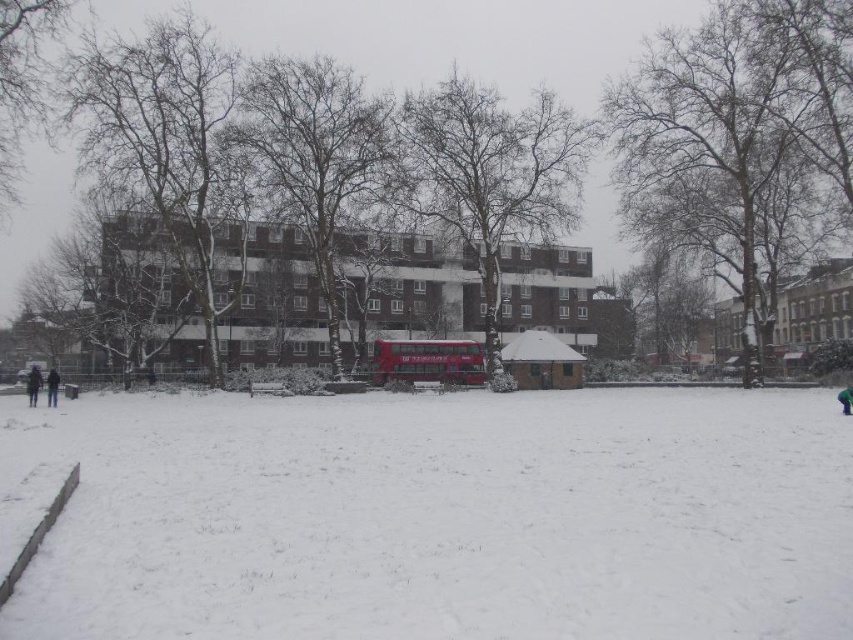
Does brown wooden bus stop at center have a larger size compared to dark blue jacket at lower left?

Incorrect, brown wooden bus stop at center is not larger than dark blue jacket at lower left.

Who is shorter, brown wooden bus stop at center or dark blue jacket at lower left?

Standing shorter between the two is dark blue jacket at lower left.

Locate an element on the screen. brown wooden bus stop at center is located at coordinates (543, 362).

Between point (444, 374) and point (531, 332), which one is positioned behind?

Point (531, 332)

Image resolution: width=853 pixels, height=640 pixels. Identify the location of red metallic double-decker bus at center. (427, 362).

Measure the distance between red metallic double-decker bus at center and camera.

They are 171.80 feet apart.

Where is `red metallic double-decker bus at center`? red metallic double-decker bus at center is located at coordinates (427, 362).

Is the position of white fluffy snow at center less distant than that of brown wooden bus stop at center?

Yes.

Identify the location of white fluffy snow at center. Image resolution: width=853 pixels, height=640 pixels. (447, 516).